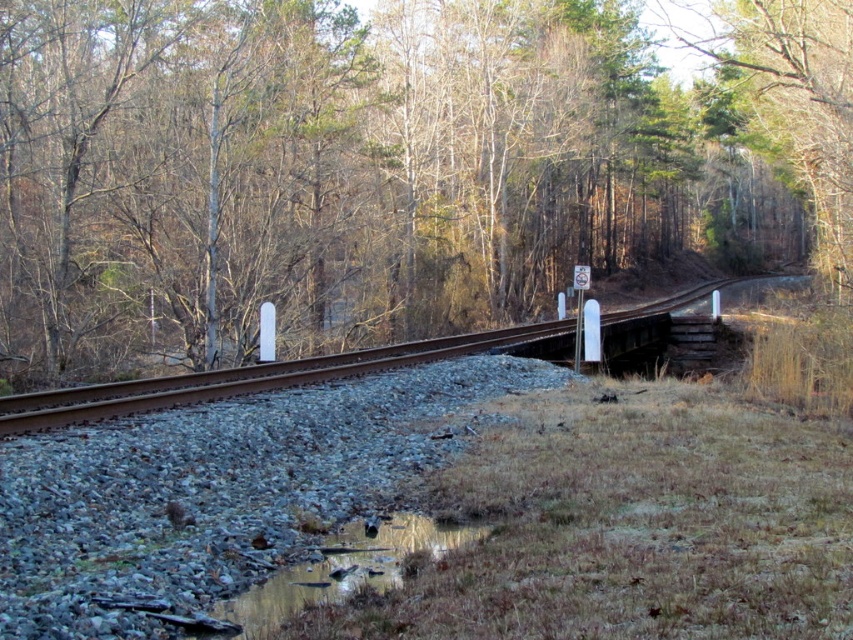
Between brown wood tree at center and brown metal train track at center, which one appears on the right side from the viewer's perspective?

brown wood tree at center is more to the right.

Image resolution: width=853 pixels, height=640 pixels. In order to click on brown wood tree at center in this screenshot , I will do `click(392, 166)`.

Is brown wood tree at center further to camera compared to reflective wet grass at lower center?

Yes, brown wood tree at center is further from the viewer.

Which is behind, point (291, 10) or point (343, 536)?

The point (291, 10) is more distant.

At what (x,y) coordinates should I click in order to perform the action: click on brown wood tree at center. Please return your answer as a coordinate pair (x, y). This screenshot has height=640, width=853. Looking at the image, I should click on (392, 166).

Can you confirm if brown metal train track at center is thinner than reflective wet grass at lower center?

In fact, brown metal train track at center might be wider than reflective wet grass at lower center.

Does point (96, 410) come behind point (262, 628)?

Yes, point (96, 410) is farther from viewer.

This screenshot has height=640, width=853. Identify the location of brown metal train track at center. (251, 378).